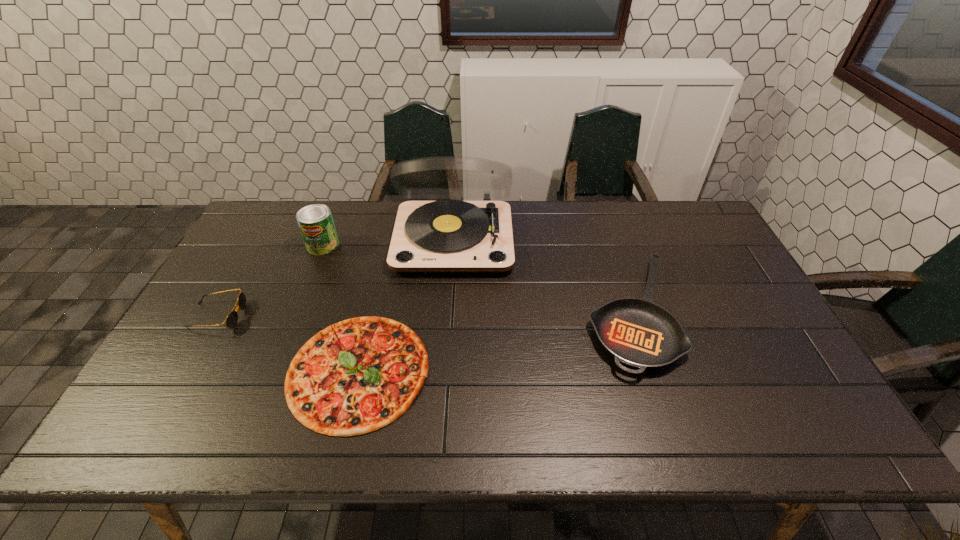
This screenshot has width=960, height=540. In order to click on vacant space in between the tallest object and the second tallest object in this screenshot , I will do `click(389, 242)`.

Identify the location of empty space between the leftmost object and the second shortest object. The height and width of the screenshot is (540, 960). (424, 315).

The image size is (960, 540). What are the coordinates of `vacant region between the record player and the pizza` in the screenshot? It's located at (406, 305).

This screenshot has height=540, width=960. I want to click on free spot between the second tallest object and the fourth tallest object, so click(477, 280).

What are the coordinates of `vacant area between the shortest object and the third shortest object` in the screenshot? It's located at (288, 343).

Locate an element on the screen. unoccupied position between the sunglasses and the record player is located at coordinates (335, 278).

Locate an element on the screen. free space between the pizza and the sunglasses is located at coordinates (x=288, y=343).

This screenshot has width=960, height=540. Identify the location of vacant area between the second shortest object and the shortest object. (495, 342).

Where is `free space between the pizza and the third tallest object`? This screenshot has width=960, height=540. free space between the pizza and the third tallest object is located at coordinates (288, 343).

The image size is (960, 540). In order to click on unoccupied area between the rightmost object and the shortest object in this screenshot , I will do `click(495, 342)`.